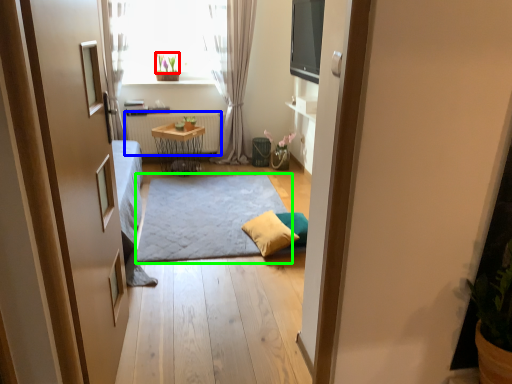
Question: Which is nearer to the plant (highlighted by a red box)? radiator (highlighted by a blue box) or doormat (highlighted by a green box).

Choices:
 (A) radiator
 (B) doormat

Answer: (A)